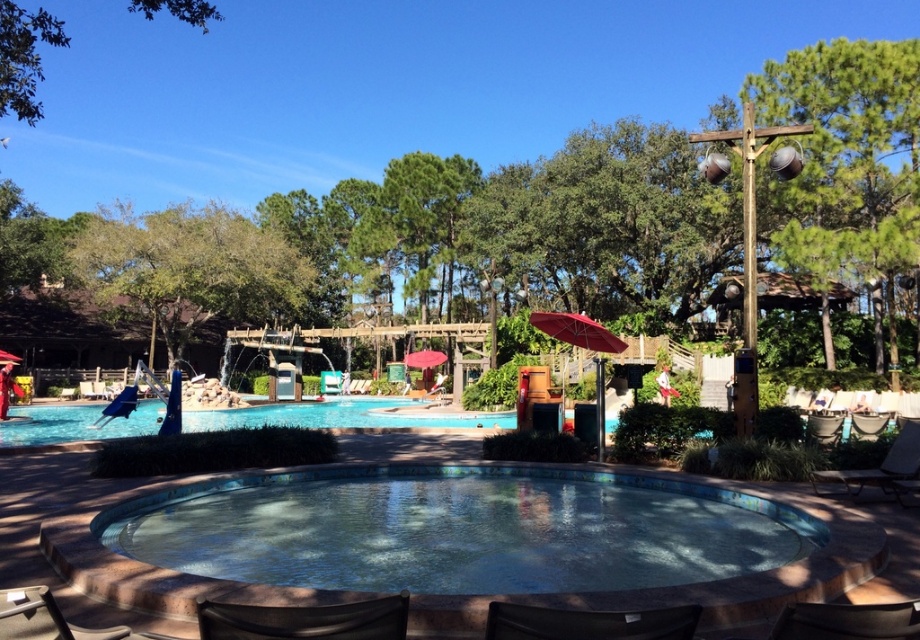
Question: Is blue mosaic pool at center positioned behind red matte umbrella at center?

Choices:
 (A) no
 (B) yes

Answer: (A)

Question: Can you confirm if dark brown wooden lounge chair at lower right is positioned below metallic silver lounge chair at lower right?

Choices:
 (A) yes
 (B) no

Answer: (B)

Question: Which object is the closest to the red fabric umbrella at center?

Choices:
 (A) brown woven chair at lower right
 (B) dark brown wooden lounge chair at lower right
 (C) black leather chair at lower right
 (D) green leafy tree at upper right

Answer: (D)

Question: Estimate the real-world distances between objects in this image. Which object is closer to the brown leather chair at lower left?

Choices:
 (A) blue mosaic pool at center
 (B) green leafy tree at upper left

Answer: (A)

Question: Which point appears closest to the camera in this image?

Choices:
 (A) (822, 58)
 (B) (428, 474)
 (C) (864, 636)
 (D) (875, 468)

Answer: (C)

Question: Can you confirm if green leafy tree at upper right is positioned to the left of dark brown wooden lounge chair at lower right?

Choices:
 (A) yes
 (B) no

Answer: (B)